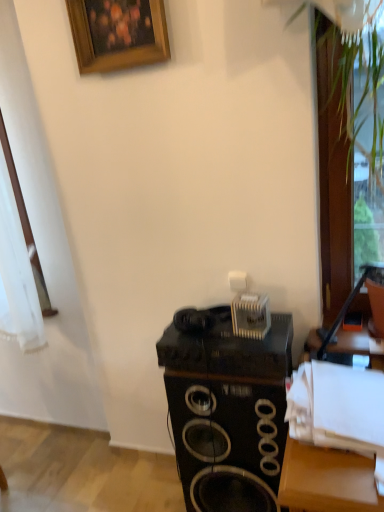
Question: Does wooden picture frame at upper center appear on the left side of black matte speaker at center?

Choices:
 (A) no
 (B) yes

Answer: (B)

Question: Is black matte speaker at center surrounded by wooden picture frame at upper center?

Choices:
 (A) no
 (B) yes

Answer: (A)

Question: Can you confirm if wooden picture frame at upper center is positioned to the right of black matte speaker at center?

Choices:
 (A) no
 (B) yes

Answer: (A)

Question: Can you confirm if wooden picture frame at upper center is wider than black matte speaker at center?

Choices:
 (A) no
 (B) yes

Answer: (A)

Question: Is wooden picture frame at upper center smaller than black matte speaker at center?

Choices:
 (A) yes
 (B) no

Answer: (A)

Question: Considering the relative positions of wooden picture frame at upper center and black matte speaker at center in the image provided, is wooden picture frame at upper center in front of black matte speaker at center?

Choices:
 (A) yes
 (B) no

Answer: (B)

Question: Can you confirm if black matte speaker at center is positioned to the left of transparent glass door at right?

Choices:
 (A) yes
 (B) no

Answer: (A)

Question: Can you confirm if black matte speaker at center is smaller than transparent glass door at right?

Choices:
 (A) no
 (B) yes

Answer: (A)

Question: From a real-world perspective, does black matte speaker at center sit lower than transparent glass door at right?

Choices:
 (A) yes
 (B) no

Answer: (A)

Question: Can you confirm if black matte speaker at center is shorter than transparent glass door at right?

Choices:
 (A) yes
 (B) no

Answer: (A)

Question: Is black matte speaker at center touching transparent glass door at right?

Choices:
 (A) yes
 (B) no

Answer: (B)

Question: Is black matte speaker at center thinner than transparent glass door at right?

Choices:
 (A) yes
 (B) no

Answer: (B)

Question: Is black matte speaker at center wider than wooden picture frame at upper center?

Choices:
 (A) yes
 (B) no

Answer: (A)